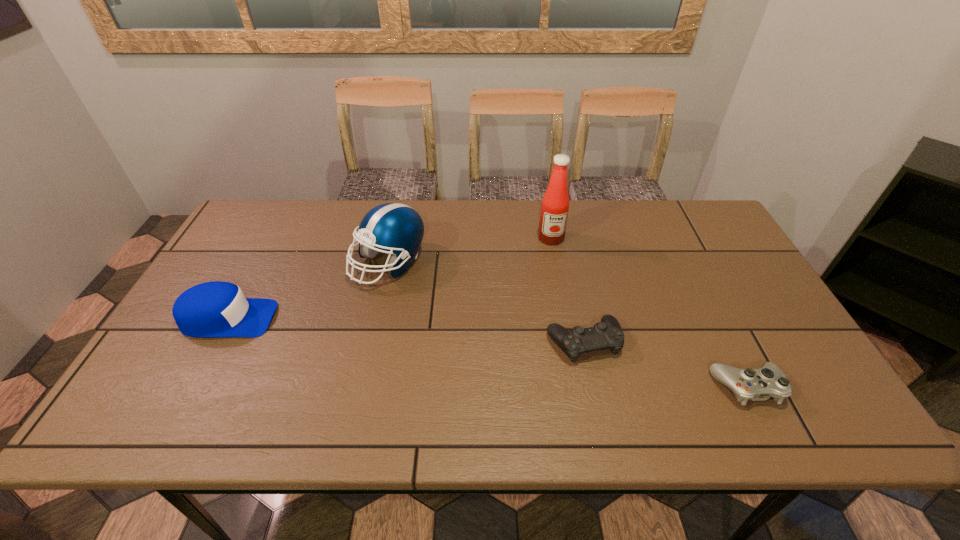
In the image, there is a desktop. Where is `vacant space at the near edge`? Image resolution: width=960 pixels, height=540 pixels. vacant space at the near edge is located at coordinates (675, 415).

Identify the location of vacant space at the left edge of the desktop. (223, 269).

In the image, there is a desktop. At what (x,y) coordinates should I click in order to perform the action: click on vacant area at the right edge. Please return your answer as a coordinate pair (x, y). Looking at the image, I should click on (716, 301).

Find the location of `free spot at the far left corner of the desktop`. free spot at the far left corner of the desktop is located at coordinates (244, 225).

Identify the location of vacant space at the far right corner of the desktop. (660, 203).

The height and width of the screenshot is (540, 960). Identify the location of vacant space in between the right control and the third tallest object. (488, 353).

Identify the location of vacant area that lies between the baseball cap and the left control. (406, 330).

The image size is (960, 540). Find the location of `free space between the condiment and the leftmost object`. free space between the condiment and the leftmost object is located at coordinates (390, 279).

You are a GUI agent. You are given a task and a screenshot of the screen. Output one action in this format:
    pyautogui.click(x=<x>, y=<y>)
    Task: Click on the vacant space in between the right control and the tallest object
    This screenshot has width=960, height=540.
    Given the screenshot: What is the action you would take?
    pyautogui.click(x=649, y=313)

Find the location of `empty space between the left control and the third shortest object`. empty space between the left control and the third shortest object is located at coordinates (406, 330).